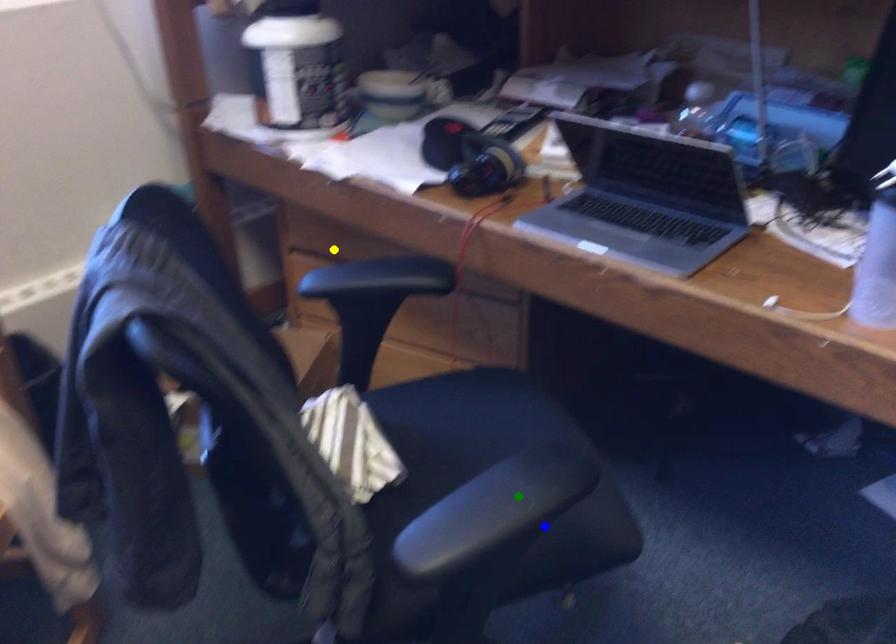
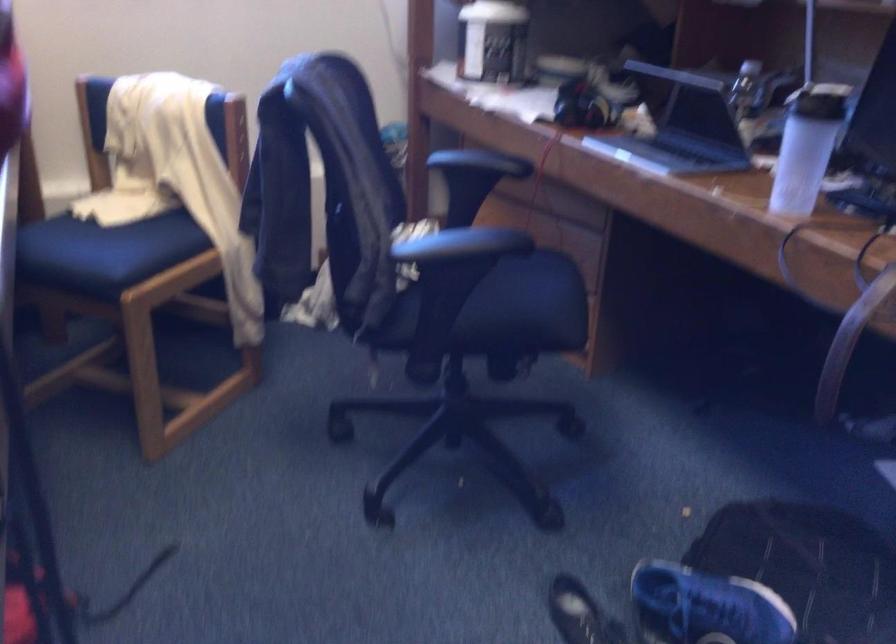
I am providing you with two images of the same scene from different viewpoints. Three points are marked in image1. Which point corresponds to a part or object that is occluded in image2?In image1, three points are marked. Which of them correspond to a part or object that is occluded in image2?Among the three points shown in image1, which one corresponds to a part or object that is no longer visible due to occlusion in image2?

yellow point